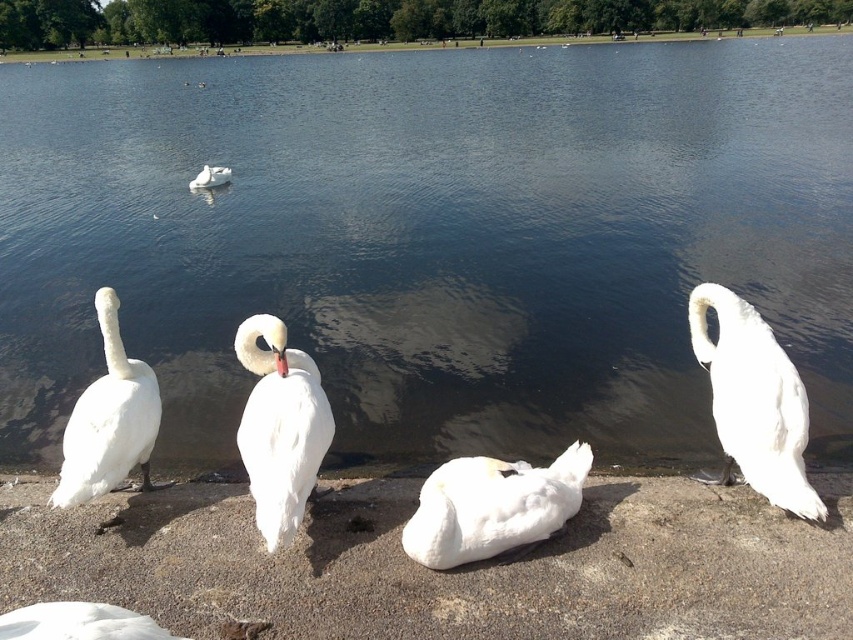
You are a photographer trying to capture the white feathered swan at right and the transparent water at center in a single frame. Based on the scene, which of these two objects occupies more horizontal space in the image?

The transparent water at center occupies more horizontal space in the image because its width is larger than that of the white feathered swan at right.

You are standing on the lakeside path and see the white feathered swan at left and the white feathered swan at upper center. Which swan is closer to the water edge?

The white feathered swan at left is positioned under the white feathered swan at upper center, meaning it is closer to the water edge.